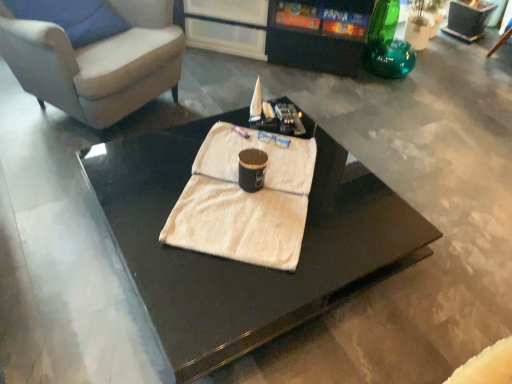
What are the coordinates of `free point above black glossy coffee table at center (from a real-world perspective)` in the screenshot? It's located at (241, 196).